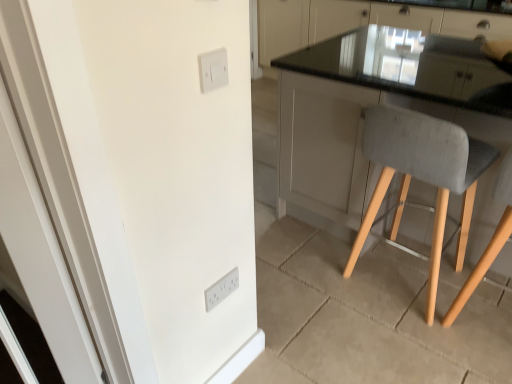
Question: Are white plastic light switch at lower center, acting as the first light switch starting from the back, and black glass countertop at upper right located far from each other?

Choices:
 (A) no
 (B) yes

Answer: (B)

Question: From a real-world perspective, is white plastic light switch at lower center, acting as the first light switch starting from the back, located higher than black glass countertop at upper right?

Choices:
 (A) no
 (B) yes

Answer: (A)

Question: Is the position of white plastic light switch at lower center, which is the second light switch from top to bottom, less distant than that of black glass countertop at upper right?

Choices:
 (A) no
 (B) yes

Answer: (B)

Question: Is black glass countertop at upper right inside white plastic light switch at lower center, acting as the first light switch starting from the back?

Choices:
 (A) no
 (B) yes

Answer: (A)

Question: Considering the relative sizes of white plastic light switch at lower center, acting as the first light switch starting from the back, and black glass countertop at upper right in the image provided, is white plastic light switch at lower center, acting as the first light switch starting from the back, wider than black glass countertop at upper right?

Choices:
 (A) yes
 (B) no

Answer: (B)

Question: Considering the relative positions of white plastic light switch at lower center, acting as the first light switch starting from the back, and gray fabric chair at right in the image provided, is white plastic light switch at lower center, acting as the first light switch starting from the back, to the left or to the right of gray fabric chair at right?

Choices:
 (A) right
 (B) left

Answer: (B)

Question: Is white plastic light switch at lower center, the second light switch from the front, wider or thinner than gray fabric chair at right?

Choices:
 (A) wide
 (B) thin

Answer: (B)

Question: From the image's perspective, is white plastic light switch at lower center, acting as the first light switch starting from the back, located above or below gray fabric chair at right?

Choices:
 (A) below
 (B) above

Answer: (A)

Question: Is point (x=221, y=296) closer or farther from the camera than point (x=373, y=205)?

Choices:
 (A) closer
 (B) farther

Answer: (A)

Question: From a real-world perspective, is white plastic light switch at lower center, the second light switch from the front, physically located above or below white plastic light switch at upper center, the first light switch viewed from the front?

Choices:
 (A) below
 (B) above

Answer: (A)

Question: From the image's perspective, is white plastic light switch at lower center, which is counted as the 1th light switch, starting from the bottom, located above or below white plastic light switch at upper center, the first light switch viewed from the front?

Choices:
 (A) below
 (B) above

Answer: (A)

Question: Is white plastic light switch at lower center, the second light switch from the front, in front of or behind white plastic light switch at upper center, the 2th light switch in the bottom-to-top sequence, in the image?

Choices:
 (A) front
 (B) behind

Answer: (B)

Question: Considering the positions of white plastic light switch at lower center, which is counted as the 1th light switch, starting from the bottom, and white plastic light switch at upper center, placed as the 2th light switch when sorted from back to front, in the image, is white plastic light switch at lower center, which is counted as the 1th light switch, starting from the bottom, wider or thinner than white plastic light switch at upper center, placed as the 2th light switch when sorted from back to front,?

Choices:
 (A) thin
 (B) wide

Answer: (B)

Question: Considering the positions of gray fabric chair at right and white glossy door at left in the image, is gray fabric chair at right wider or thinner than white glossy door at left?

Choices:
 (A) thin
 (B) wide

Answer: (B)

Question: Considering their positions, is gray fabric chair at right located in front of or behind white glossy door at left?

Choices:
 (A) front
 (B) behind

Answer: (B)